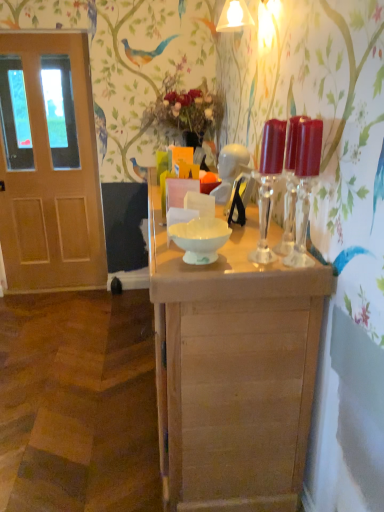
The height and width of the screenshot is (512, 384). Find the location of `free spot above wooden door at left (from a real-world perspective)`. free spot above wooden door at left (from a real-world perspective) is located at coordinates (40, 34).